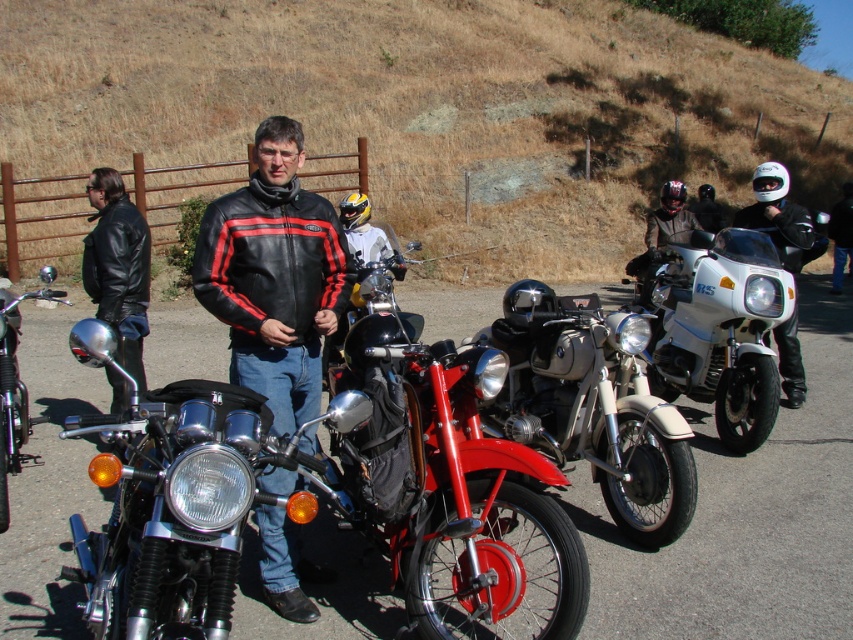
Question: Which object is closer to the camera taking this photo?

Choices:
 (A) shiny chrome handlebars at left
 (B) white glossy motorcycle at center right
 (C) shiny red motorcycle at center

Answer: (C)

Question: Which object is the farthest from the chrome/metallic motorcycle at center?

Choices:
 (A) shiny chrome handlebars at left
 (B) black leather jacket at center

Answer: (A)

Question: Is dry grass at upper center above shiny chrome motorcycle at center?

Choices:
 (A) no
 (B) yes

Answer: (B)

Question: Which object appears closest to the camera in this image?

Choices:
 (A) shiny chrome motorcycle at center
 (B) white matte helmet at upper right

Answer: (A)

Question: Can you confirm if white glossy motorcycle at center right is positioned to the left of white matte helmet at upper right?

Choices:
 (A) no
 (B) yes

Answer: (B)

Question: Can you confirm if white matte helmet at center is wider than shiny chrome handlebars at left?

Choices:
 (A) yes
 (B) no

Answer: (A)